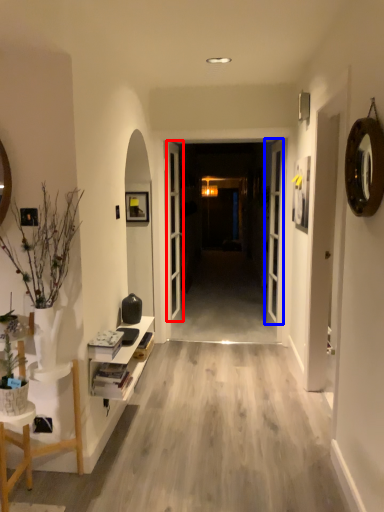
Question: Among these objects, which one is nearest to the camera, door (highlighted by a red box) or door (highlighted by a blue box)?

Choices:
 (A) door
 (B) door

Answer: (B)